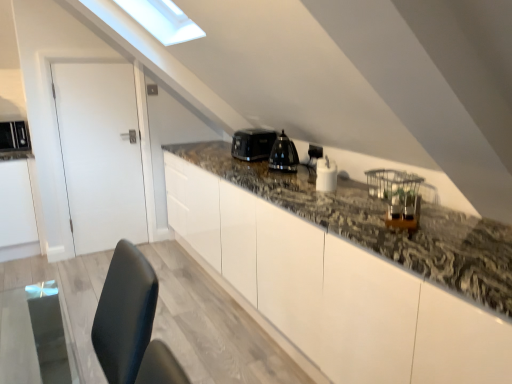
Image resolution: width=512 pixels, height=384 pixels. What do you see at coordinates (326, 175) in the screenshot?
I see `white glossy salt shaker at center, which is the 2th appliance from right to left` at bounding box center [326, 175].

The width and height of the screenshot is (512, 384). Describe the element at coordinates (283, 154) in the screenshot. I see `black glossy kettle at center, which ranks as the 3th appliance in right-to-left order` at that location.

What is the approximate height of matte black microwave at left, placed as the fifth appliance when sorted from right to left?

The height of matte black microwave at left, placed as the fifth appliance when sorted from right to left, is 10.98 inches.

What do you see at coordinates (100, 154) in the screenshot? The width and height of the screenshot is (512, 384). I see `white matte door at left` at bounding box center [100, 154].

What do you see at coordinates (253, 144) in the screenshot?
I see `black plastic toaster at center, the second appliance when ordered from left to right` at bounding box center [253, 144].

Where is `white glossy salt shaker at center, the first appliance viewed from the front`? The width and height of the screenshot is (512, 384). white glossy salt shaker at center, the first appliance viewed from the front is located at coordinates pyautogui.click(x=326, y=175).

Visually, is black glossy kettle at upper center, the 1th appliance in the right-to-left sequence, positioned to the left or to the right of matte black microwave at left, acting as the 5th appliance starting from the front?

Based on their positions, black glossy kettle at upper center, the 1th appliance in the right-to-left sequence, is located to the right of matte black microwave at left, acting as the 5th appliance starting from the front.

Could you tell me if black glossy kettle at upper center, the 1th appliance in the right-to-left sequence, is turned towards matte black microwave at left, arranged as the first appliance when viewed from the left?

No, black glossy kettle at upper center, the 1th appliance in the right-to-left sequence, is not oriented towards matte black microwave at left, arranged as the first appliance when viewed from the left.

Is black glossy kettle at upper center, positioned as the 3th appliance in back-to-front order, shorter than matte black microwave at left, marked as the 1th appliance in a back-to-front arrangement?

Yes, black glossy kettle at upper center, positioned as the 3th appliance in back-to-front order, is shorter than matte black microwave at left, marked as the 1th appliance in a back-to-front arrangement.

From a real-world perspective, who is located higher, black plastic toaster at center, the 4th appliance when ordered from right to left, or black glossy kettle at center, positioned as the 3th appliance in left-to-right order?

black plastic toaster at center, the 4th appliance when ordered from right to left, from a real-world perspective.

From the image's perspective, would you say black plastic toaster at center, the 4th appliance when ordered from right to left, is positioned over black glossy kettle at center, which ranks as the 4th appliance in back-to-front order?

Indeed, from the image's perspective, black plastic toaster at center, the 4th appliance when ordered from right to left, is shown above black glossy kettle at center, which ranks as the 4th appliance in back-to-front order.

Which object is thinner, black plastic toaster at center, the 4th appliance when ordered from right to left, or black glossy kettle at center, the second appliance when ordered from front to back?

black glossy kettle at center, the second appliance when ordered from front to back.

Can you confirm if white matte door at left is positioned to the left of matte black microwave at left, marked as the 1th appliance in a back-to-front arrangement?

In fact, white matte door at left is to the right of matte black microwave at left, marked as the 1th appliance in a back-to-front arrangement.

Is white matte door at left in front of or behind matte black microwave at left, marked as the 1th appliance in a back-to-front arrangement, in the image?

white matte door at left is positioned closer to the viewer than matte black microwave at left, marked as the 1th appliance in a back-to-front arrangement.

From the picture: Are white matte door at left and matte black microwave at left, arranged as the first appliance when viewed from the left, beside each other?

white matte door at left and matte black microwave at left, arranged as the first appliance when viewed from the left, are not in contact.

Considering the points (124, 144) and (9, 145), which point is in front, point (124, 144) or point (9, 145)?

The point (9, 145) is in front.

From a real-world perspective, is black glossy kettle at center, which ranks as the 4th appliance in back-to-front order, under granite countertop at center?

No.

From the picture: Considering the relative sizes of black glossy kettle at center, positioned as the 3th appliance in left-to-right order, and granite countertop at center in the image provided, is black glossy kettle at center, positioned as the 3th appliance in left-to-right order, wider than granite countertop at center?

No.

In the image, is black glossy kettle at center, which ranks as the 3th appliance in right-to-left order, on the left side or the right side of granite countertop at center?

Based on their positions, black glossy kettle at center, which ranks as the 3th appliance in right-to-left order, is located to the left of granite countertop at center.

Does point (283, 160) come in front of point (370, 350)?

No.

Could you tell me if black plastic toaster at center, positioned as the second appliance in back-to-front order, is turned towards granite countertop at center?

No, black plastic toaster at center, positioned as the second appliance in back-to-front order, is not turned towards granite countertop at center.

Does point (243, 144) come in front of point (412, 318)?

No, it is behind (412, 318).

Does black plastic toaster at center, the 4th appliance when ordered from right to left, have a smaller size compared to granite countertop at center?

Correct, black plastic toaster at center, the 4th appliance when ordered from right to left, occupies less space than granite countertop at center.

Where is `the 4th appliance behind the granite countertop at center`? This screenshot has width=512, height=384. the 4th appliance behind the granite countertop at center is located at coordinates (253, 144).

Visually, is white matte door at left positioned to the left or to the right of white glossy salt shaker at center, which is counted as the fourth appliance, starting from the left?

Based on their positions, white matte door at left is located to the left of white glossy salt shaker at center, which is counted as the fourth appliance, starting from the left.

Between white matte door at left and white glossy salt shaker at center, which is counted as the fourth appliance, starting from the left, which one has smaller width?

white matte door at left.

Is white glossy salt shaker at center, the fifth appliance in the back-to-front sequence, inside white matte door at left?

That's incorrect, white glossy salt shaker at center, the fifth appliance in the back-to-front sequence, is not inside white matte door at left.

Is black glossy kettle at center, positioned as the 3th appliance in left-to-right order, shorter than black glossy kettle at upper center, the 1th appliance in the right-to-left sequence?

Incorrect, the height of black glossy kettle at center, positioned as the 3th appliance in left-to-right order, does not fall short of that of black glossy kettle at upper center, the 1th appliance in the right-to-left sequence.

Which is closer, (x=271, y=154) or (x=314, y=155)?

The point (x=314, y=155) is closer.

Based on the photo, from a real-world perspective, is black glossy kettle at center, which ranks as the 3th appliance in right-to-left order, under black glossy kettle at upper center, positioned as the 3th appliance in back-to-front order?

Answer: No.

This screenshot has height=384, width=512. I want to click on appliance that is the 2nd object located behind the black glossy kettle at upper center, positioned as the 3th appliance in back-to-front order, so click(x=14, y=136).

Which appliance is the 2nd one when counting from the front of the black plastic toaster at center, the second appliance when ordered from left to right? Please provide its 2D coordinates.

[(283, 154)]

Considering their positions, is black glossy kettle at center, positioned as the 3th appliance in left-to-right order, positioned further to black plastic toaster at center, positioned as the second appliance in back-to-front order, than white matte door at left?

white matte door at left.

Based on their spatial positions, is matte black microwave at left, arranged as the first appliance when viewed from the left, or black glossy kettle at upper center, positioned as the 3th appliance in back-to-front order, further from white matte door at left?

black glossy kettle at upper center, positioned as the 3th appliance in back-to-front order, is positioned further to the anchor white matte door at left.

Looking at this image, which object lies further to the anchor point black plastic toaster at center, the second appliance when ordered from left to right, granite countertop at center or black glossy kettle at upper center, positioned as the 3th appliance in back-to-front order?

granite countertop at center is positioned further to the anchor black plastic toaster at center, the second appliance when ordered from left to right.

From the image, which object appears to be nearer to black plastic toaster at center, the 4th appliance when ordered from front to back, granite countertop at center or black glossy kettle at center, positioned as the 3th appliance in left-to-right order?

Based on the image, black glossy kettle at center, positioned as the 3th appliance in left-to-right order, appears to be nearer to black plastic toaster at center, the 4th appliance when ordered from front to back.

Estimate the real-world distances between objects in this image. Which object is further from white glossy salt shaker at center, the first appliance viewed from the front, black glossy kettle at center, the second appliance when ordered from front to back, or white matte door at left?

white matte door at left.

Based on their spatial positions, is white matte door at left or black plastic toaster at center, the second appliance when ordered from left to right, closer to white glossy salt shaker at center, the first appliance viewed from the front?

Based on the image, black plastic toaster at center, the second appliance when ordered from left to right, appears to be nearer to white glossy salt shaker at center, the first appliance viewed from the front.

Looking at the image, which one is located further to white glossy salt shaker at center, which is the 2th appliance from right to left, matte black microwave at left, marked as the 1th appliance in a back-to-front arrangement, or granite countertop at center?

Based on the image, matte black microwave at left, marked as the 1th appliance in a back-to-front arrangement, appears to be further to white glossy salt shaker at center, which is the 2th appliance from right to left.

Based on their spatial positions, is black plastic toaster at center, positioned as the second appliance in back-to-front order, or black glossy kettle at center, which ranks as the 4th appliance in back-to-front order, further from black glossy kettle at upper center, the third appliance positioned from the front?

black plastic toaster at center, positioned as the second appliance in back-to-front order, is further to black glossy kettle at upper center, the third appliance positioned from the front.

Where is `countertop situated between matte black microwave at left, arranged as the first appliance when viewed from the left, and black glossy kettle at upper center, positioned as the 3th appliance in back-to-front order, from left to right`? countertop situated between matte black microwave at left, arranged as the first appliance when viewed from the left, and black glossy kettle at upper center, positioned as the 3th appliance in back-to-front order, from left to right is located at coordinates (350, 270).

Locate an element on the screen. door located between matte black microwave at left, placed as the fifth appliance when sorted from right to left, and black plastic toaster at center, the 4th appliance when ordered from front to back, in the left-right direction is located at coordinates (100, 154).

The height and width of the screenshot is (384, 512). I want to click on door between granite countertop at center and matte black microwave at left, arranged as the first appliance when viewed from the left, from front to back, so click(100, 154).

This screenshot has height=384, width=512. I want to click on door between matte black microwave at left, acting as the 5th appliance starting from the front, and white glossy salt shaker at center, which is counted as the fourth appliance, starting from the left, in the horizontal direction, so click(100, 154).